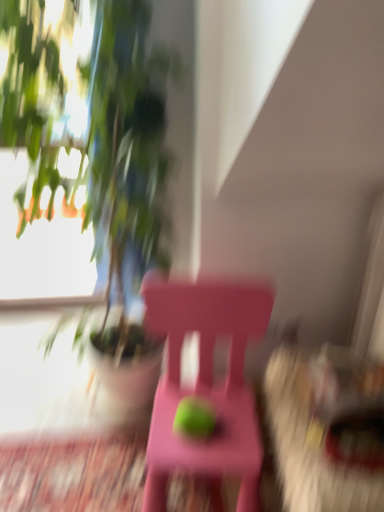
The image size is (384, 512). Describe the element at coordinates (206, 384) in the screenshot. I see `pink plastic chair at center` at that location.

Describe the element at coordinates (128, 152) in the screenshot. This screenshot has width=384, height=512. I see `green matte plant at upper left` at that location.

Describe the element at coordinates (194, 418) in the screenshot. I see `green matte apple at center` at that location.

Where is `pink plastic chair at center`? pink plastic chair at center is located at coordinates (206, 384).

Does pink plastic chair at center turn towards green matte apple at center?

Yes, pink plastic chair at center is turned towards green matte apple at center.

Consider the image. Is pink plastic chair at center far away from green matte apple at center?

Actually, pink plastic chair at center and green matte apple at center are a little close together.

Does point (148, 319) lie in front of point (190, 415)?

No, (148, 319) is further to viewer.

From the image's perspective, which is above, pink plastic chair at center or green matte apple at center?

From the image's view, pink plastic chair at center is above.

In terms of width, does pink plastic chair at center look wider or thinner when compared to green matte plant at upper left?

In the image, pink plastic chair at center appears to be more narrow than green matte plant at upper left.

Is point (234, 459) positioned after point (117, 106)?

No, it is not.

Measure the distance from pink plastic chair at center to green matte plant at upper left.

pink plastic chair at center is 15.69 inches from green matte plant at upper left.

Would you say green matte plant at upper left is to the left or to the right of green matte apple at center in the picture?

Clearly, green matte plant at upper left is on the left of green matte apple at center in the image.

Does green matte plant at upper left have a larger size compared to green matte apple at center?

Indeed, green matte plant at upper left has a larger size compared to green matte apple at center.

Is the position of green matte plant at upper left less distant than that of green matte apple at center?

Yes, green matte plant at upper left is in front of green matte apple at center.

Where is `fruit that is on the right side of green matte plant at upper left`? fruit that is on the right side of green matte plant at upper left is located at coordinates (194, 418).

Is green matte plant at upper left to the right of pink plastic chair at center from the viewer's perspective?

No.

Is green matte plant at upper left oriented away from pink plastic chair at center?

green matte plant at upper left does not have its back to pink plastic chair at center.

Is green matte plant at upper left in contact with pink plastic chair at center?

No.

From the picture: Is green matte plant at upper left bigger than pink plastic chair at center?

Correct, green matte plant at upper left is larger in size than pink plastic chair at center.

Does green matte apple at center lie in front of green matte plant at upper left?

No, the depth of green matte apple at center is greater than that of green matte plant at upper left.

Which is in front, point (201, 429) or point (117, 173)?

The point (201, 429) is in front.

From the picture: From a real-world perspective, is green matte apple at center physically above green matte plant at upper left?

No, from a real-world perspective, green matte apple at center is not above green matte plant at upper left.

Is green matte apple at center taller than green matte plant at upper left?

In fact, green matte apple at center may be shorter than green matte plant at upper left.

Looking at the image, does green matte apple at center seem bigger or smaller compared to pink plastic chair at center?

Considering their sizes, green matte apple at center takes up less space than pink plastic chair at center.

Is green matte apple at center to the left or to the right of pink plastic chair at center in the image?

Based on their positions, green matte apple at center is located to the left of pink plastic chair at center.

Does green matte apple at center lie behind pink plastic chair at center?

Yes, green matte apple at center is further from the camera.

Do you think green matte apple at center is within pink plastic chair at center, or outside of it?

green matte apple at center is inside pink plastic chair at center.

You are a GUI agent. You are given a task and a screenshot of the screen. Output one action in this format:
    pyautogui.click(x=<x>, y=<y>)
    Task: Click on the chair in front of the green matte apple at center
    
    Given the screenshot: What is the action you would take?
    pyautogui.click(x=206, y=384)

Identify the location of chair that appears on the right of green matte plant at upper left. This screenshot has width=384, height=512. (206, 384).

From the picture: Which object lies further to the anchor point pink plastic chair at center, green matte apple at center or green matte plant at upper left?

green matte plant at upper left.

Which object lies further to the anchor point green matte apple at center, pink plastic chair at center or green matte plant at upper left?

green matte plant at upper left.

Considering their positions, is green matte plant at upper left positioned further to pink plastic chair at center than green matte apple at center?

green matte plant at upper left.

Estimate the real-world distances between objects in this image. Which object is further from green matte apple at center, green matte plant at upper left or pink plastic chair at center?

green matte plant at upper left.

When comparing their distances from green matte plant at upper left, does green matte apple at center or pink plastic chair at center seem further?

green matte apple at center.

Considering their positions, is pink plastic chair at center positioned closer to green matte plant at upper left than green matte apple at center?

Based on the image, pink plastic chair at center appears to be nearer to green matte plant at upper left.

In order to click on chair that lies between green matte plant at upper left and green matte apple at center from top to bottom in this screenshot , I will do `click(206, 384)`.